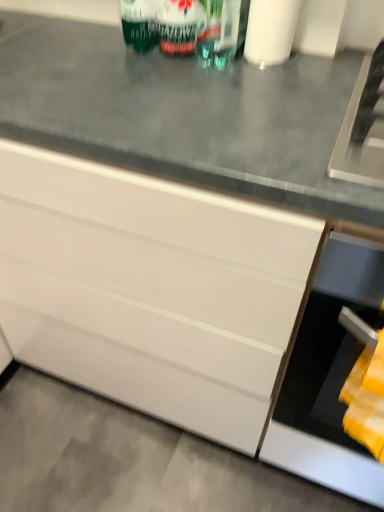
The height and width of the screenshot is (512, 384). Identify the location of vacant space in front of green matte can at upper center. (158, 77).